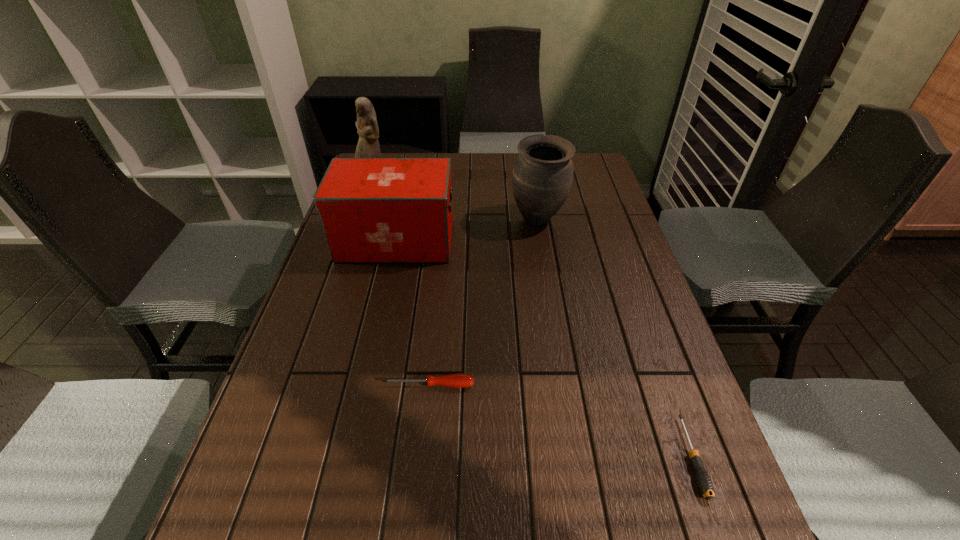
This screenshot has height=540, width=960. What are the coordinates of `vacant position located on the back of the fourth farthest object` in the screenshot? It's located at (434, 329).

The height and width of the screenshot is (540, 960). Find the location of `free space located 0.220m on the left of the rightmost object`. free space located 0.220m on the left of the rightmost object is located at coordinates (568, 457).

The image size is (960, 540). I want to click on object situated at the far edge, so click(x=368, y=146).

At what (x,y) coordinates should I click in order to perform the action: click on figurine located in the left edge section of the desktop. Please return your answer as a coordinate pair (x, y). Looking at the image, I should click on (368, 146).

At what (x,y) coordinates should I click in order to perform the action: click on the first-aid kit situated at the left edge. Please return your answer as a coordinate pair (x, y). The width and height of the screenshot is (960, 540). Looking at the image, I should click on (372, 210).

Where is `object that is at the right edge`? object that is at the right edge is located at coordinates (705, 485).

At what (x,y) coordinates should I click in order to perform the action: click on object present at the far left corner. Please return your answer as a coordinate pair (x, y). The width and height of the screenshot is (960, 540). Looking at the image, I should click on (368, 146).

Locate an element on the screen. vacant space at the far edge is located at coordinates (472, 170).

Where is `free space at the left edge of the desktop`? The width and height of the screenshot is (960, 540). free space at the left edge of the desktop is located at coordinates (273, 488).

The height and width of the screenshot is (540, 960). I want to click on free space at the right edge, so click(x=608, y=250).